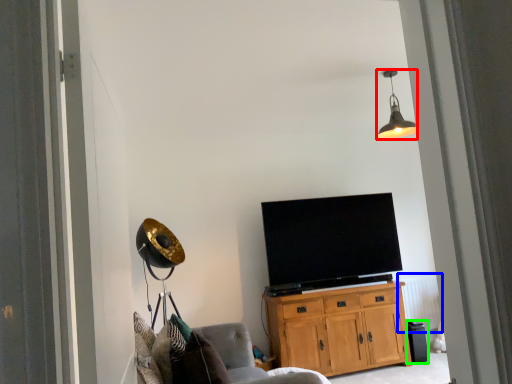
Question: Which object is positioned farthest from lamp (highlighted by a red box)? Select from radiator (highlighted by a blue box) and trash bin/can (highlighted by a green box).

Choices:
 (A) radiator
 (B) trash bin/can

Answer: (B)